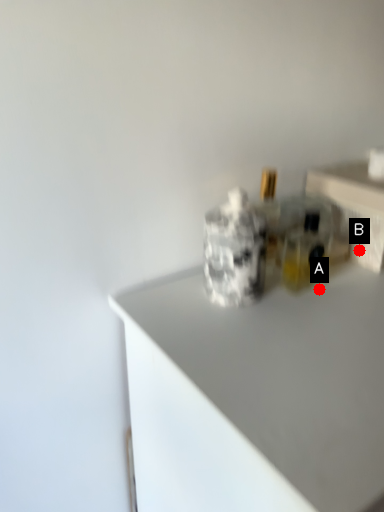
Question: Two points are circled on the image, labeled by A and B beside each circle. Among these points, which one is farthest from the camera?

Choices:
 (A) A is further
 (B) B is further

Answer: (B)